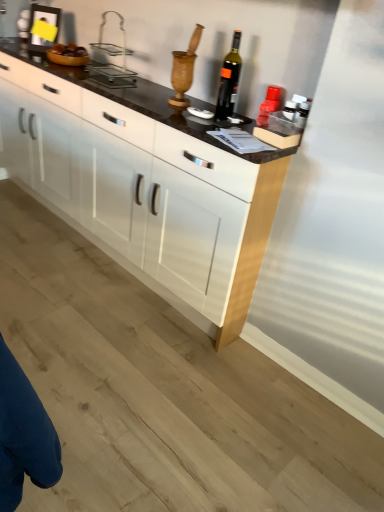
Question: Does dark glass bottle at center appear on the right side of white glossy cabinet at center?

Choices:
 (A) yes
 (B) no

Answer: (A)

Question: Is dark glass bottle at center at the left side of white glossy cabinet at center?

Choices:
 (A) no
 (B) yes

Answer: (A)

Question: From a real-world perspective, is dark glass bottle at center located higher than white glossy cabinet at center?

Choices:
 (A) yes
 (B) no

Answer: (A)

Question: Considering the relative sizes of dark glass bottle at center and white glossy cabinet at center in the image provided, is dark glass bottle at center smaller than white glossy cabinet at center?

Choices:
 (A) no
 (B) yes

Answer: (B)

Question: Is dark glass bottle at center thinner than white glossy cabinet at center?

Choices:
 (A) no
 (B) yes

Answer: (B)

Question: From the image's perspective, is clear plastic basket at upper center positioned above or below white glossy cabinet at center?

Choices:
 (A) above
 (B) below

Answer: (A)

Question: Considering the positions of clear plastic basket at upper center and white glossy cabinet at center in the image, is clear plastic basket at upper center taller or shorter than white glossy cabinet at center?

Choices:
 (A) short
 (B) tall

Answer: (A)

Question: Considering their positions, is clear plastic basket at upper center located in front of or behind white glossy cabinet at center?

Choices:
 (A) behind
 (B) front

Answer: (A)

Question: Would you say clear plastic basket at upper center is to the left or to the right of white glossy cabinet at center in the picture?

Choices:
 (A) right
 (B) left

Answer: (A)

Question: Is dark glass bottle at center bigger or smaller than clear plastic basket at upper center?

Choices:
 (A) small
 (B) big

Answer: (A)

Question: Would you say dark glass bottle at center is inside or outside clear plastic basket at upper center?

Choices:
 (A) inside
 (B) outside

Answer: (B)

Question: From a real-world perspective, is dark glass bottle at center positioned above or below clear plastic basket at upper center?

Choices:
 (A) above
 (B) below

Answer: (A)

Question: Is dark glass bottle at center wider or thinner than clear plastic basket at upper center?

Choices:
 (A) thin
 (B) wide

Answer: (A)

Question: From the image's perspective, is white glossy cabinet at center above or below dark glass bottle at center?

Choices:
 (A) above
 (B) below

Answer: (B)

Question: From a real-world perspective, is white glossy cabinet at center above or below dark glass bottle at center?

Choices:
 (A) below
 (B) above

Answer: (A)